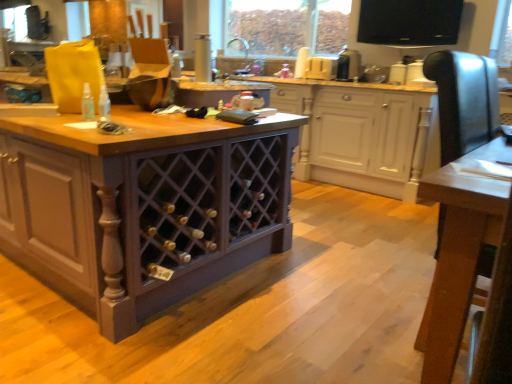
What do you see at coordinates (87, 104) in the screenshot? This screenshot has height=384, width=512. I see `translucent plastic spray bottle at center` at bounding box center [87, 104].

Identify the location of black plastic toaster at upper center. Image resolution: width=512 pixels, height=384 pixels. (348, 64).

Does translucent plastic spray bottle at center have a smaller size compared to purple wood wine rack at center, the 1th cabinetry when ordered from front to back?

Correct, translucent plastic spray bottle at center occupies less space than purple wood wine rack at center, the 1th cabinetry when ordered from front to back.

Can purple wood wine rack at center, which appears as the second cabinetry when viewed from the back, be found inside translucent plastic spray bottle at center?

Actually, purple wood wine rack at center, which appears as the second cabinetry when viewed from the back, is outside translucent plastic spray bottle at center.

The width and height of the screenshot is (512, 384). What are the coordinates of `bottle behind the purple wood wine rack at center, the 1th cabinetry when ordered from front to back` in the screenshot? It's located at (87, 104).

How many degrees apart are the facing directions of translucent plastic spray bottle at center and purple wood wine rack at center, which appears as the second cabinetry when viewed from the back?

There is a 1.08-degree angle between the facing directions of translucent plastic spray bottle at center and purple wood wine rack at center, which appears as the second cabinetry when viewed from the back.

Between black plastic toaster at upper center and purple wood wine rack at center, the 1th cabinetry viewed from the back, which one is positioned behind?

black plastic toaster at upper center is behind.

Is black plastic toaster at upper center inside or outside of purple wood wine rack at center, the 1th cabinetry viewed from the back?

black plastic toaster at upper center is located beyond the bounds of purple wood wine rack at center, the 1th cabinetry viewed from the back.

Looking at this image, between black plastic toaster at upper center and purple wood wine rack at center, the 1th cabinetry viewed from the back, which one appears on the left side from the viewer's perspective?

purple wood wine rack at center, the 1th cabinetry viewed from the back.

Considering the sizes of black plastic toaster at upper center and purple wood wine rack at center, the second cabinetry positioned from the front, in the image, is black plastic toaster at upper center bigger or smaller than purple wood wine rack at center, the second cabinetry positioned from the front,?

In the image, black plastic toaster at upper center appears to be smaller than purple wood wine rack at center, the second cabinetry positioned from the front.

Would you consider purple wood wine rack at center, the 1th cabinetry viewed from the back, to be distant from purple wood wine rack at center, the 1th cabinetry when ordered from front to back?

purple wood wine rack at center, the 1th cabinetry viewed from the back, is positioned a significant distance from purple wood wine rack at center, the 1th cabinetry when ordered from front to back.

How far apart are purple wood wine rack at center, the 1th cabinetry viewed from the back, and purple wood wine rack at center, which appears as the second cabinetry when viewed from the back?

purple wood wine rack at center, the 1th cabinetry viewed from the back, and purple wood wine rack at center, which appears as the second cabinetry when viewed from the back, are 1.92 meters apart from each other.

From a real-world perspective, is purple wood wine rack at center, the second cabinetry positioned from the front, located beneath purple wood wine rack at center, the 1th cabinetry when ordered from front to back?

No.

Which is nearer, (317, 168) or (106, 338)?

Point (317, 168) is positioned farther from the camera compared to point (106, 338).

Can you tell me how much black plastic toaster at upper center and translucent plastic spray bottle at center differ in facing direction?

The angle between the facing direction of black plastic toaster at upper center and the facing direction of translucent plastic spray bottle at center is 92.3 degrees.

In terms of height, does black plastic toaster at upper center look taller or shorter compared to translucent plastic spray bottle at center?

black plastic toaster at upper center is taller than translucent plastic spray bottle at center.

Can you confirm if black plastic toaster at upper center is smaller than translucent plastic spray bottle at center?

No, black plastic toaster at upper center is not smaller than translucent plastic spray bottle at center.

Is black plastic toaster at upper center positioned beyond the bounds of translucent plastic spray bottle at center?

Yes, black plastic toaster at upper center is not within translucent plastic spray bottle at center.

From the picture: Are purple wood wine rack at center, the 1th cabinetry viewed from the back, and translucent plastic spray bottle at center beside each other?

purple wood wine rack at center, the 1th cabinetry viewed from the back, and translucent plastic spray bottle at center are clearly separated.

Who is more distant, purple wood wine rack at center, the second cabinetry positioned from the front, or translucent plastic spray bottle at center?

purple wood wine rack at center, the second cabinetry positioned from the front, is more distant.

Between purple wood wine rack at center, the 1th cabinetry viewed from the back, and translucent plastic spray bottle at center, which one has larger size?

purple wood wine rack at center, the 1th cabinetry viewed from the back, is bigger.

Would you say translucent plastic spray bottle at center is part of purple wood wine rack at center, the second cabinetry positioned from the front,'s contents?

Definitely not — translucent plastic spray bottle at center is not inside purple wood wine rack at center, the second cabinetry positioned from the front.

From a real-world perspective, is wooden table at center physically below translucent plastic spray bottle at center?

Indeed, from a real-world perspective, wooden table at center is positioned beneath translucent plastic spray bottle at center.

Which is nearer, (431, 334) or (85, 97)?

Point (431, 334) is positioned closer to the camera compared to point (85, 97).

Is wooden table at center inside or outside of translucent plastic spray bottle at center?

wooden table at center is outside translucent plastic spray bottle at center.

Considering the sizes of wooden table at center and translucent plastic spray bottle at center in the image, is wooden table at center wider or thinner than translucent plastic spray bottle at center?

In the image, wooden table at center appears to be wider than translucent plastic spray bottle at center.

Does translucent plastic spray bottle at center have a lesser width compared to wooden table at center?

Correct, the width of translucent plastic spray bottle at center is less than that of wooden table at center.

How much distance is there between translucent plastic spray bottle at center and wooden table at center?

A distance of 1.45 meters exists between translucent plastic spray bottle at center and wooden table at center.

Does translucent plastic spray bottle at center come behind wooden table at center?

Yes.

Is translucent plastic spray bottle at center inside or outside of wooden table at center?

translucent plastic spray bottle at center is not enclosed by wooden table at center.

From the translucent plastic spray bottle at center, count 1st cabinetry to the right and point to it. Please provide its 2D coordinates.

[(143, 206)]

Starting from the black plastic toaster at upper center, which cabinetry is the 1st one in front? Please provide its 2D coordinates.

[(361, 134)]

Estimate the real-world distances between objects in this image. Which object is further from translucent plastic spray bottle at center, purple wood wine rack at center, which appears as the second cabinetry when viewed from the back, or black plastic toaster at upper center?

black plastic toaster at upper center is positioned further to the anchor translucent plastic spray bottle at center.

Looking at the image, which one is located closer to translucent plastic spray bottle at center, purple wood wine rack at center, the 1th cabinetry viewed from the back, or wooden table at center?

wooden table at center is closer to translucent plastic spray bottle at center.

When comparing their distances from purple wood wine rack at center, the 1th cabinetry when ordered from front to back, does purple wood wine rack at center, the 1th cabinetry viewed from the back, or black plastic toaster at upper center seem further?

black plastic toaster at upper center is positioned further to the anchor purple wood wine rack at center, the 1th cabinetry when ordered from front to back.

When comparing their distances from black plastic toaster at upper center, does translucent plastic spray bottle at center or purple wood wine rack at center, the 1th cabinetry viewed from the back, seem closer?

purple wood wine rack at center, the 1th cabinetry viewed from the back.

From the picture: From the image, which object appears to be farther from wooden table at center, purple wood wine rack at center, the second cabinetry positioned from the front, or black plastic toaster at upper center?

black plastic toaster at upper center lies further to wooden table at center than the other object.

Considering their positions, is black plastic toaster at upper center positioned further to wooden table at center than translucent plastic spray bottle at center?

The object further to wooden table at center is black plastic toaster at upper center.

When comparing their distances from wooden table at center, does translucent plastic spray bottle at center or purple wood wine rack at center, the second cabinetry positioned from the front, seem further?

Based on the image, purple wood wine rack at center, the second cabinetry positioned from the front, appears to be further to wooden table at center.

Considering their positions, is black plastic toaster at upper center positioned further to wooden table at center than purple wood wine rack at center, the 1th cabinetry viewed from the back?

black plastic toaster at upper center is further to wooden table at center.

Find the location of a particular element. The width and height of the screenshot is (512, 384). cabinetry between wooden table at center and purple wood wine rack at center, the 1th cabinetry viewed from the back, in the front-back direction is located at coordinates (143, 206).

The height and width of the screenshot is (384, 512). I want to click on bottle located between purple wood wine rack at center, the 1th cabinetry when ordered from front to back, and purple wood wine rack at center, the second cabinetry positioned from the front, in the depth direction, so click(87, 104).

I want to click on cabinetry between purple wood wine rack at center, which appears as the second cabinetry when viewed from the back, and black plastic toaster at upper center, along the z-axis, so click(361, 134).

Where is `bottle between wooden table at center and purple wood wine rack at center, the second cabinetry positioned from the front, in the front-back direction`? The height and width of the screenshot is (384, 512). bottle between wooden table at center and purple wood wine rack at center, the second cabinetry positioned from the front, in the front-back direction is located at coordinates (87, 104).